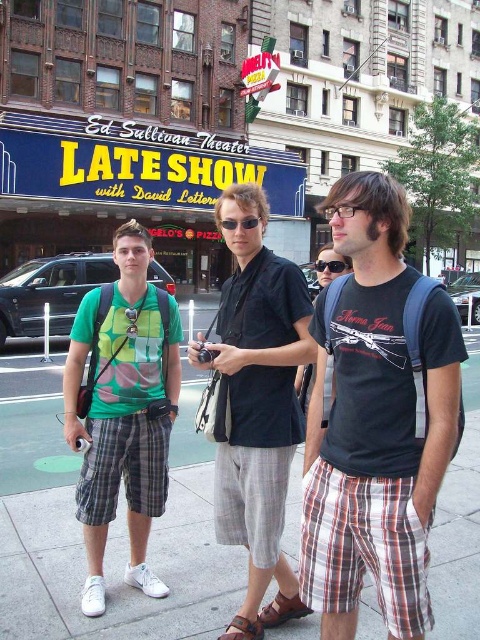
Question: Can you confirm if black cotton t-shirt at center is positioned below green matte t-shirt at left?

Choices:
 (A) no
 (B) yes

Answer: (A)

Question: Which point is farther to the camera?

Choices:
 (A) (244, 224)
 (B) (467, 554)
 (C) (405, 460)

Answer: (B)

Question: Which point is farther to the camera?

Choices:
 (A) (256, 593)
 (B) (320, 272)
 (C) (233, 227)
 (D) (181, 579)

Answer: (B)

Question: Considering the real-world distances, which object is closest to the black cotton t-shirt at center?

Choices:
 (A) black cotton shirt at center
 (B) black plastic goggles at center

Answer: (A)

Question: Is black cotton shirt at center above black plastic goggles at center?

Choices:
 (A) yes
 (B) no

Answer: (B)

Question: Observing the image, what is the correct spatial positioning of green matte t-shirt at left in reference to matte black goggles at center?

Choices:
 (A) left
 (B) right

Answer: (A)